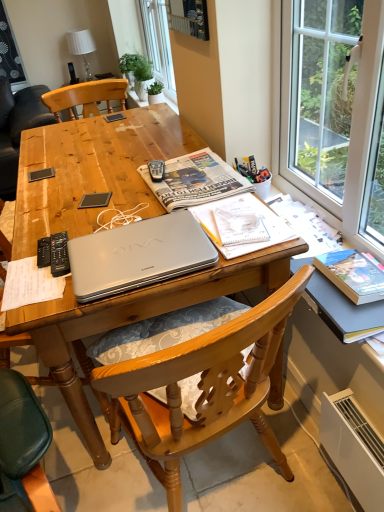
In order to click on free spot behind black plastic remote control at left, which is counted as the second remote control, starting from the right in this screenshot , I will do `click(56, 220)`.